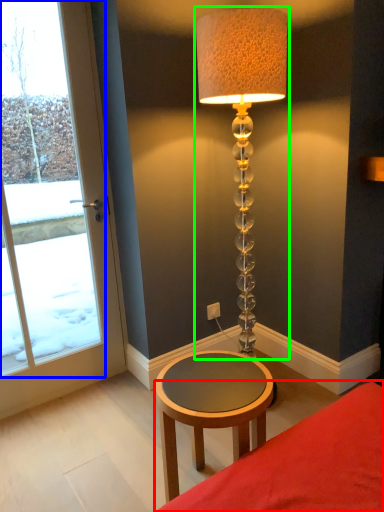
Question: Based on their relative distances, which object is nearer to furniture (highlighted by a red box)? Choose from window (highlighted by a blue box) and lamp (highlighted by a green box).

Choices:
 (A) window
 (B) lamp

Answer: (B)